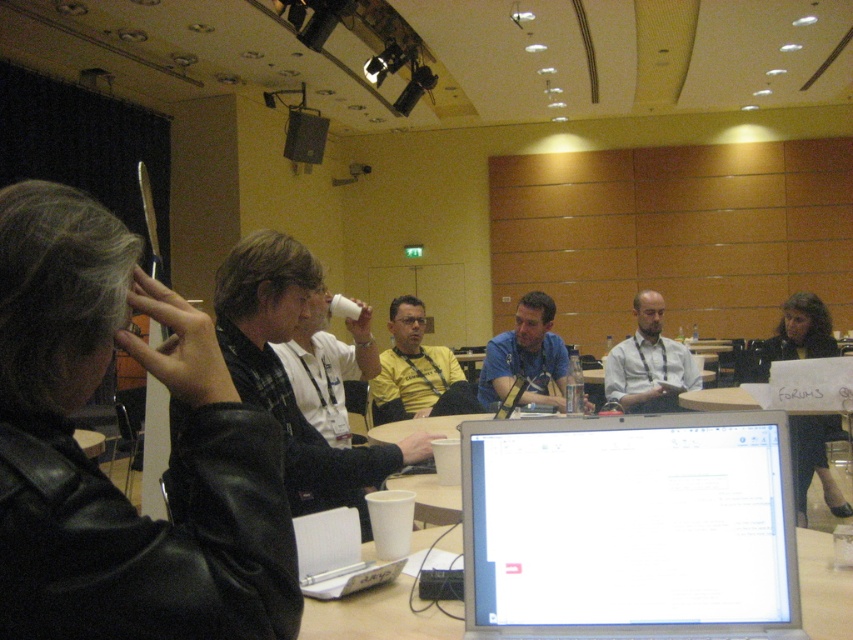
Question: Does white matte cup at center appear under white plastic laptop at center?

Choices:
 (A) no
 (B) yes

Answer: (A)

Question: Is matte black shirt at center wider than matte black speaker at upper center?

Choices:
 (A) yes
 (B) no

Answer: (A)

Question: Which of the following is the closest to the observer?

Choices:
 (A) black leather jacket at center
 (B) matte black shirt at center

Answer: (A)

Question: Is white matte cup at center to the left of matte plastic laptop at center from the viewer's perspective?

Choices:
 (A) yes
 (B) no

Answer: (A)

Question: Which object appears closest to the camera in this image?

Choices:
 (A) white plastic laptop at center
 (B) white matte cup at center
 (C) black leather jacket at left

Answer: (C)

Question: Which point appears farthest from the camera in this image?

Choices:
 (A) (692, 358)
 (B) (386, 458)

Answer: (A)